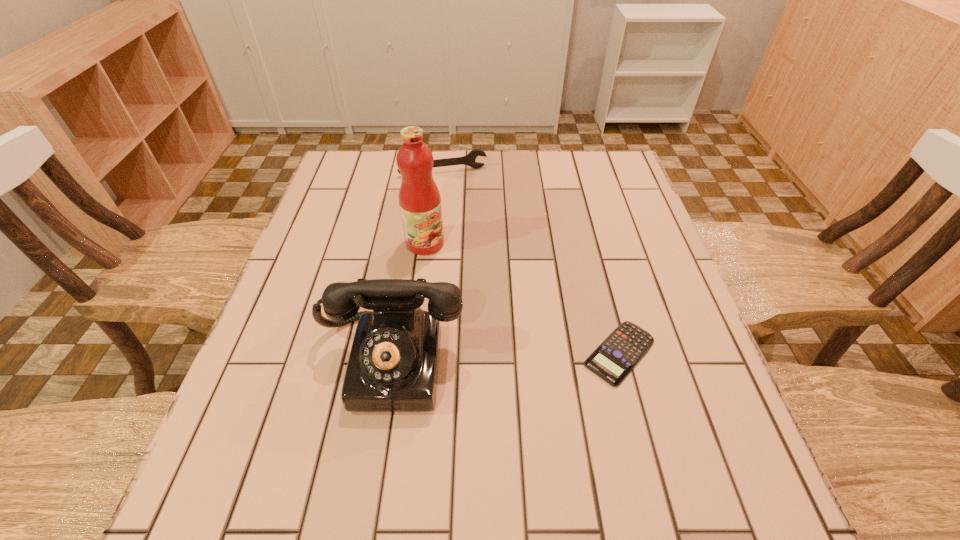
Locate an element on the screen. the second tallest object is located at coordinates (393, 364).

Identify the location of calculator. (620, 352).

Where is `the rightmost object`? Image resolution: width=960 pixels, height=540 pixels. the rightmost object is located at coordinates (620, 352).

Locate an element on the screen. This screenshot has height=540, width=960. the farthest object is located at coordinates (469, 159).

Where is `wrench`? wrench is located at coordinates (469, 159).

Where is `the tallest object`? the tallest object is located at coordinates (419, 198).

Identify the location of fruit juice. The width and height of the screenshot is (960, 540). (419, 198).

Where is `vacant space located 0.330m on the left of the shortest object`? Image resolution: width=960 pixels, height=540 pixels. vacant space located 0.330m on the left of the shortest object is located at coordinates (417, 353).

Find the location of a particular element. The image size is (960, 540). blank space located on the open ends of the third tallest object is located at coordinates (472, 256).

At what (x,y) coordinates should I click in order to perform the action: click on free spot located on the open ends of the third tallest object. Please return your answer as a coordinate pair (x, y). The image size is (960, 540). Looking at the image, I should click on (455, 191).